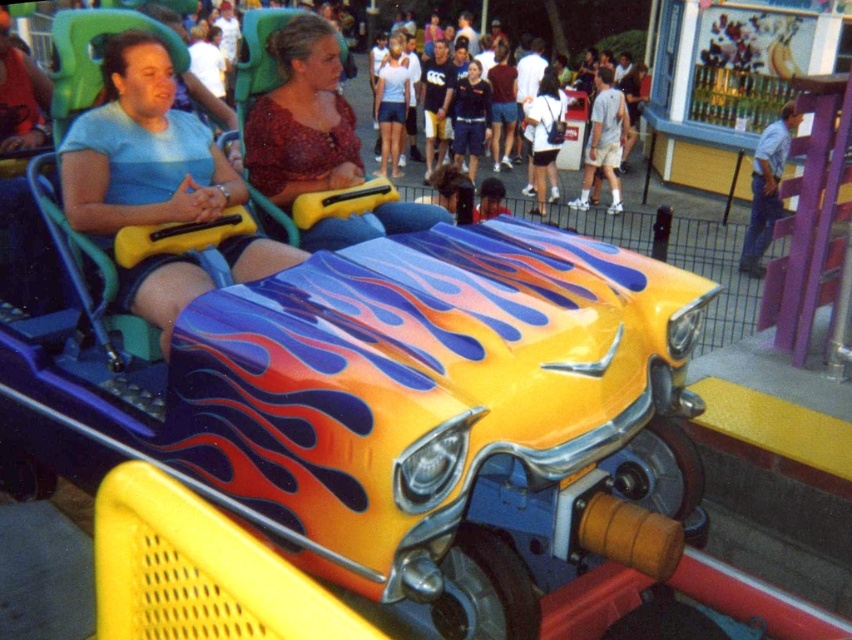
From the picture: Between matte blue shorts at left and matte red blouse at center, which one has more height?

matte blue shorts at left

From the picture: Who is more distant from viewer, (157, 275) or (360, 221)?

The point (360, 221) is more distant.

The width and height of the screenshot is (852, 640). In order to click on matte blue shorts at left in this screenshot , I will do `click(141, 150)`.